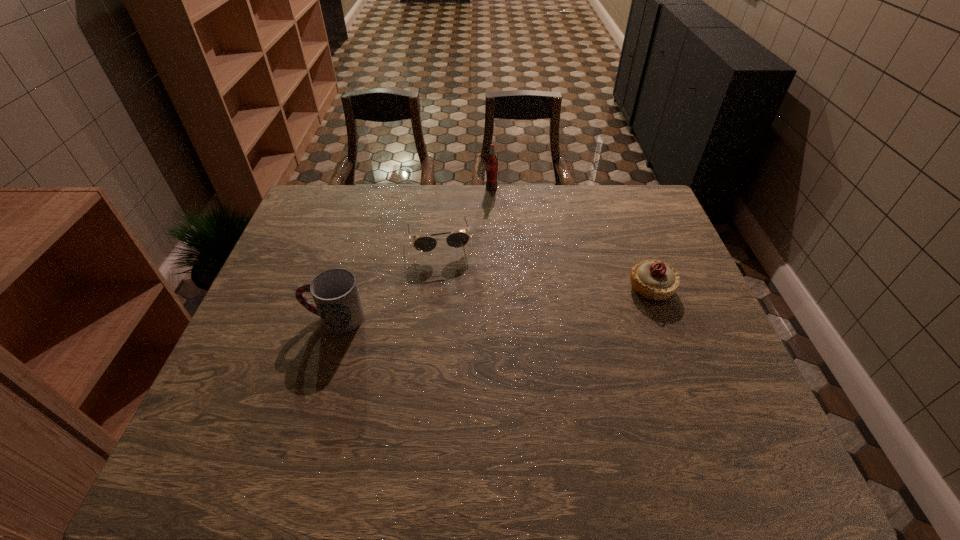
You are a GUI agent. You are given a task and a screenshot of the screen. Output one action in this format:
    pyautogui.click(x=<x>, y=<y>)
    Task: Click on the vacant space on the desktop that is between the third shortest object and the pastry and is positioned on the front lenses of the second farthest object
    
    Given the screenshot: What is the action you would take?
    pyautogui.click(x=453, y=306)

Locate an element on the screen. Image resolution: width=960 pixels, height=540 pixels. free space on the desktop that is between the cup and the rightmost object and is positioned on the label of the second object from right to left is located at coordinates (491, 303).